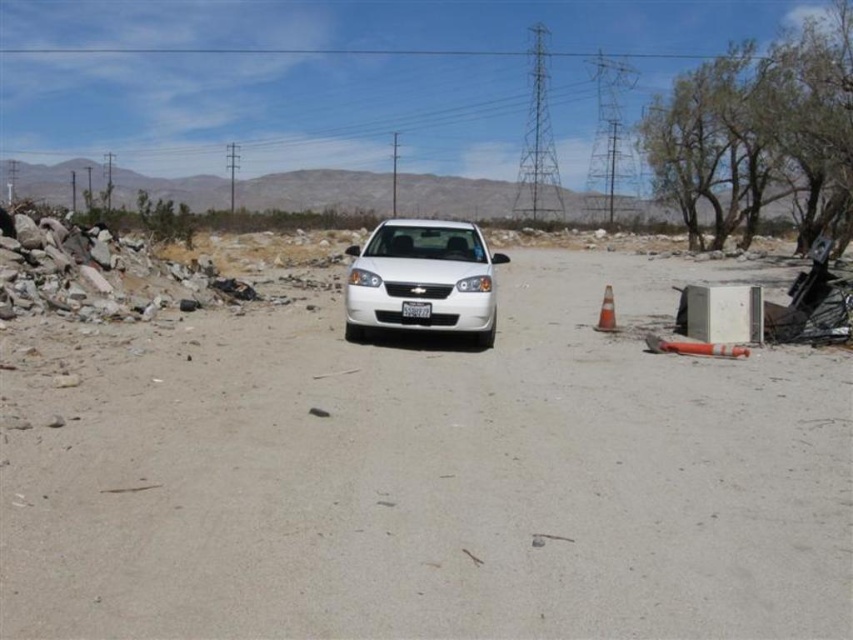
Who is more distant from viewer, [526,604] or [605,314]?

The point [605,314] is more distant.

Is smooth sand at center positioned behind orange reflective cone at right?

That is False.

Measure the distance between smooth sand at center and camera.

smooth sand at center is 3.54 meters from camera.

This screenshot has height=640, width=853. I want to click on smooth sand at center, so click(437, 477).

Is point (486, 298) positioned behind point (613, 304)?

No.

Is white glossy sedan at center wider than orange reflective cone at right?

Correct, the width of white glossy sedan at center exceeds that of orange reflective cone at right.

Which is in front, point (434, 262) or point (608, 285)?

Positioned in front is point (434, 262).

Image resolution: width=853 pixels, height=640 pixels. I want to click on white glossy sedan at center, so click(x=422, y=278).

Is smooth sand at center closer to camera compared to white plastic license plate at center?

Yes, smooth sand at center is closer to the viewer.

Does point (827, 564) come farther from viewer compared to point (427, 316)?

No, it is not.

Where is `smooth sand at center`? smooth sand at center is located at coordinates (437, 477).

Where is `smooth sand at center`? This screenshot has width=853, height=640. smooth sand at center is located at coordinates (437, 477).